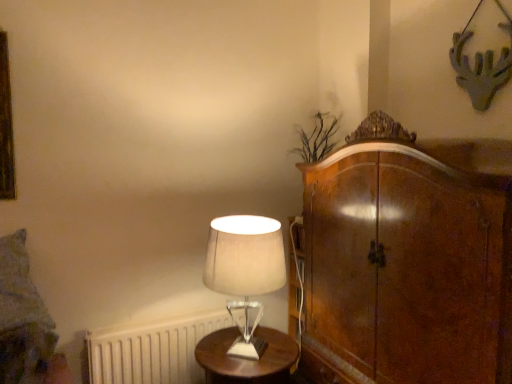
Measure the distance between point (x=9, y=251) and camera.

A distance of 1.56 meters exists between point (x=9, y=251) and camera.

Where is `white fabric lampshade at center`? white fabric lampshade at center is located at coordinates (245, 271).

From the picture: From the image's perspective, which one is positioned higher, wooden round table at center or textured gray pillow at left?

textured gray pillow at left.

Between wooden round table at center and textured gray pillow at left, which one is positioned in front?

textured gray pillow at left.

Is wooden round table at center situated inside textured gray pillow at left or outside?

wooden round table at center is located beyond the bounds of textured gray pillow at left.

Is white matte radiator at lower left located within white fabric lampshade at center?

No, white matte radiator at lower left is not a part of white fabric lampshade at center.

Is white fabric lampshade at center oriented towards white matte radiator at lower left?

No, white fabric lampshade at center does not turn towards white matte radiator at lower left.

Is white fabric lampshade at center positioned in front of white matte radiator at lower left?

Yes, white fabric lampshade at center is closer to the viewer.

From a real-world perspective, is white fabric lampshade at center positioned above or below white matte radiator at lower left?

white fabric lampshade at center is situated higher than white matte radiator at lower left in the real world.

Which of these two, wooden round table at center or white matte radiator at lower left, stands taller?

With more height is white matte radiator at lower left.

Is wooden round table at center placed right next to white matte radiator at lower left?

No, wooden round table at center is not beside white matte radiator at lower left.

Which is less distant, (265, 337) or (202, 317)?

Point (265, 337) is closer to the camera than point (202, 317).

Would you say wooden round table at center is to the left or to the right of white matte radiator at lower left in the picture?

In the image, wooden round table at center appears on the right side of white matte radiator at lower left.

From the image's perspective, which is below, white matte radiator at lower left or wooden round table at center?

wooden round table at center appears lower in the image.

From a real-world perspective, between white matte radiator at lower left and wooden round table at center, who is vertically lower?

white matte radiator at lower left, from a real-world perspective.

Is white matte radiator at lower left oriented towards wooden round table at center?

Yes, white matte radiator at lower left is aimed at wooden round table at center.

Looking at this image, does white matte radiator at lower left contain wooden round table at center?

Definitely not — wooden round table at center is not inside white matte radiator at lower left.

From a real-world perspective, is textured gray pillow at left below white matte radiator at lower left?

No, from a real-world perspective, textured gray pillow at left is not beneath white matte radiator at lower left.

From the image's perspective, is textured gray pillow at left below white matte radiator at lower left?

No, from the image's perspective, textured gray pillow at left is not beneath white matte radiator at lower left.

Considering the relative sizes of white matte radiator at lower left and textured gray pillow at left in the image provided, is white matte radiator at lower left bigger than textured gray pillow at left?

Indeed, white matte radiator at lower left has a larger size compared to textured gray pillow at left.

How many degrees apart are the facing directions of white matte radiator at lower left and textured gray pillow at left?

They differ by 0.917 degrees in their facing directions.

Can you confirm if white matte radiator at lower left is positioned to the left of textured gray pillow at left?

Incorrect, white matte radiator at lower left is not on the left side of textured gray pillow at left.

From the image's perspective, is white matte radiator at lower left above or below textured gray pillow at left?

white matte radiator at lower left is below textured gray pillow at left.

Can you confirm if textured gray pillow at left is smaller than wooden round table at center?

Yes, textured gray pillow at left is smaller than wooden round table at center.

How many degrees apart are the facing directions of textured gray pillow at left and wooden round table at center?

0.412 degrees separate the facing orientations of textured gray pillow at left and wooden round table at center.

Image resolution: width=512 pixels, height=384 pixels. Identify the location of table below the textured gray pillow at left (from a real-world perspective). (246, 358).

Looking at this image, is textured gray pillow at left completely or partially outside of wooden round table at center?

Absolutely, textured gray pillow at left is external to wooden round table at center.

At what (x,y) coordinates should I click in order to perform the action: click on pillow above the wooden round table at center (from the image's perspective). Please return your answer as a coordinate pair (x, y). The width and height of the screenshot is (512, 384). Looking at the image, I should click on (19, 286).

Identify the location of radiator directly beneath the white fabric lampshade at center (from a real-world perspective). This screenshot has height=384, width=512. pyautogui.click(x=152, y=350).

Looking at the image, which one is located closer to textured gray pillow at left, white matte radiator at lower left or wooden round table at center?

Among the two, white matte radiator at lower left is located nearer to textured gray pillow at left.

When comparing their distances from wooden round table at center, does textured gray pillow at left or white matte radiator at lower left seem closer?

white matte radiator at lower left.

When comparing their distances from wooden round table at center, does white matte radiator at lower left or textured gray pillow at left seem further?

Among the two, textured gray pillow at left is located further to wooden round table at center.

Considering their positions, is white fabric lampshade at center positioned further to white matte radiator at lower left than wooden round table at center?

white fabric lampshade at center lies further to white matte radiator at lower left than the other object.

When comparing their distances from wooden round table at center, does textured gray pillow at left or white fabric lampshade at center seem further?

textured gray pillow at left lies further to wooden round table at center than the other object.

From the image, which object appears to be nearer to textured gray pillow at left, white fabric lampshade at center or wooden round table at center?

Based on the image, wooden round table at center appears to be nearer to textured gray pillow at left.

Estimate the real-world distances between objects in this image. Which object is further from white matte radiator at lower left, textured gray pillow at left or white fabric lampshade at center?

white fabric lampshade at center.

Based on their spatial positions, is white fabric lampshade at center or textured gray pillow at left closer to wooden round table at center?

Based on the image, white fabric lampshade at center appears to be nearer to wooden round table at center.

Identify the location of radiator that lies between white fabric lampshade at center and wooden round table at center from top to bottom. This screenshot has height=384, width=512. (152, 350).

The image size is (512, 384). I want to click on radiator situated between textured gray pillow at left and white fabric lampshade at center from left to right, so click(152, 350).

Where is `lamp between textured gray pillow at left and wooden round table at center`? The width and height of the screenshot is (512, 384). lamp between textured gray pillow at left and wooden round table at center is located at coordinates (245, 271).

Image resolution: width=512 pixels, height=384 pixels. In order to click on radiator located between textured gray pillow at left and wooden round table at center in the left-right direction in this screenshot , I will do `click(152, 350)`.